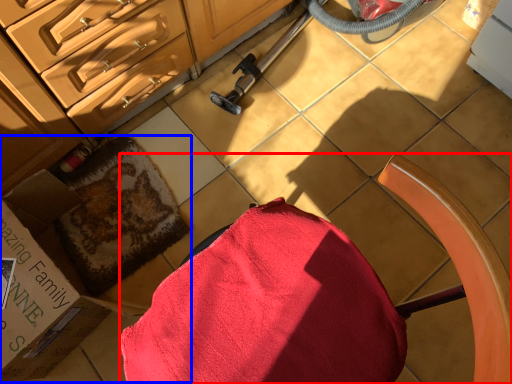
Question: Among these objects, which one is nearest to the camera, chair (highlighted by a red box) or box (highlighted by a blue box)?

Choices:
 (A) chair
 (B) box

Answer: (A)